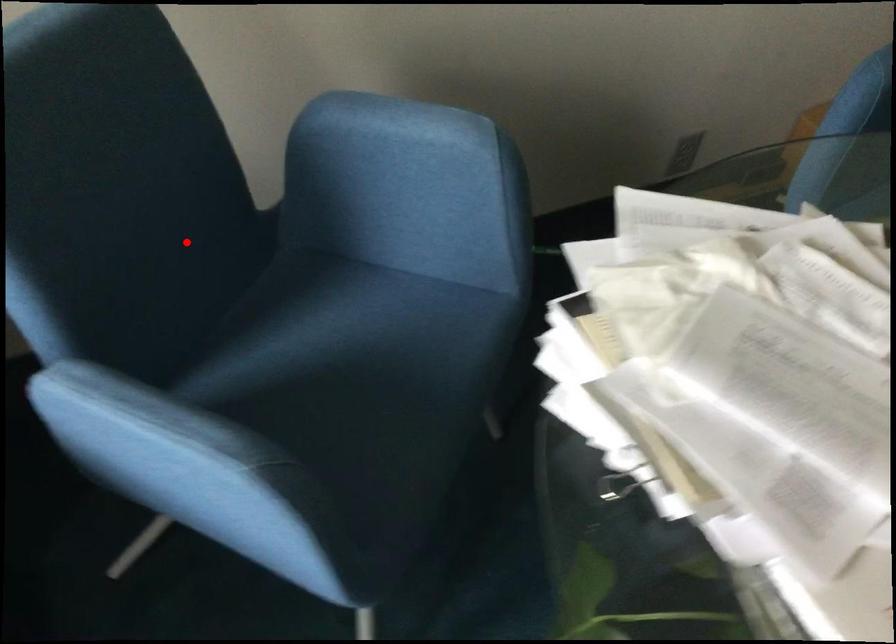
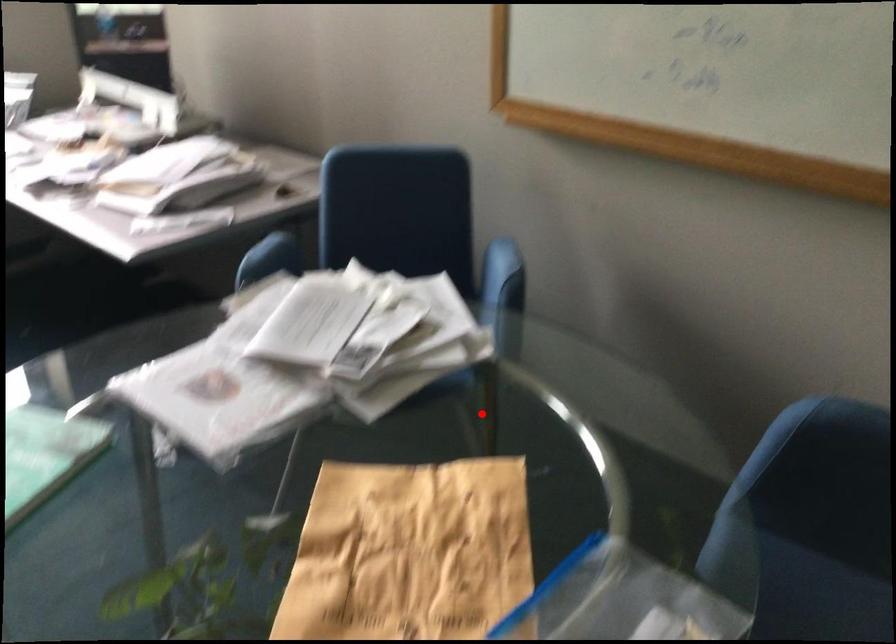
I am providing you with two images of the same scene from different viewpoints. A red point is marked on the first image and another point is marked on the second image. Is the marked point in image1 the same physical position as the marked point in image2?

No